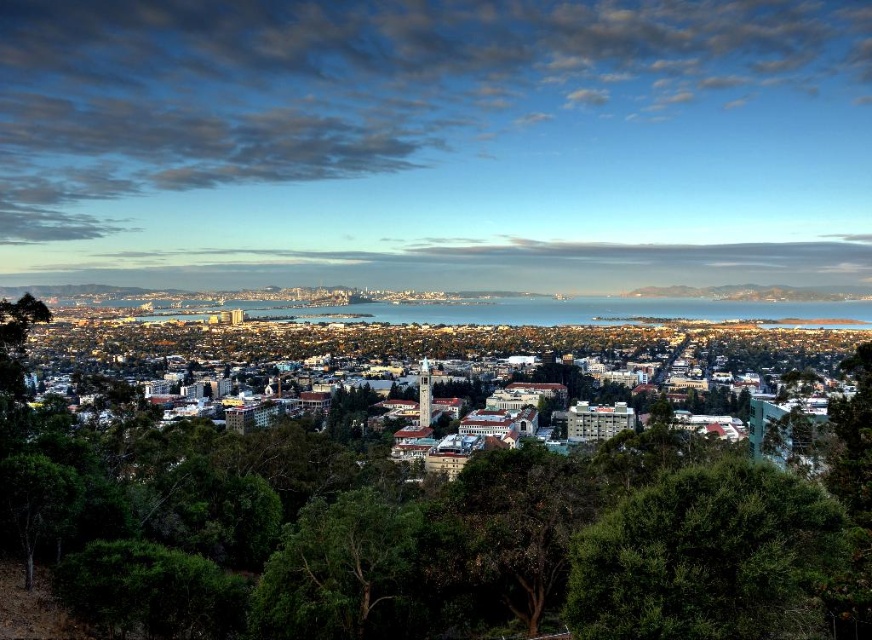
The image size is (872, 640). What do you see at coordinates (436, 141) in the screenshot? I see `blue sky at upper center` at bounding box center [436, 141].

Who is more distant from viewer, (140, 1) or (755, 605)?

The point (140, 1) is more distant.

The width and height of the screenshot is (872, 640). In order to click on blue sky at upper center in this screenshot , I will do `click(436, 141)`.

The height and width of the screenshot is (640, 872). What are the coordinates of `blue sky at upper center` in the screenshot? It's located at (436, 141).